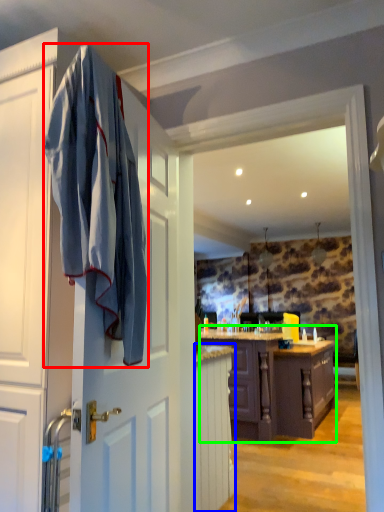
Question: Considering the real-world distances, which object is closest to bath towel (highlighted by a red box)? cabinetry (highlighted by a blue box) or cabinetry (highlighted by a green box).

Choices:
 (A) cabinetry
 (B) cabinetry

Answer: (A)